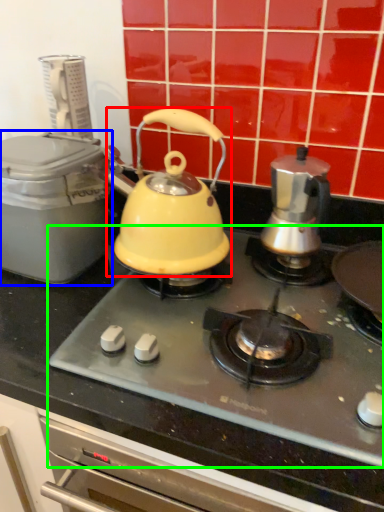
Question: Which is farther away from kettle (highlighted by a red box)? kitchen appliance (highlighted by a blue box) or gas stove (highlighted by a green box)?

Choices:
 (A) kitchen appliance
 (B) gas stove

Answer: (B)